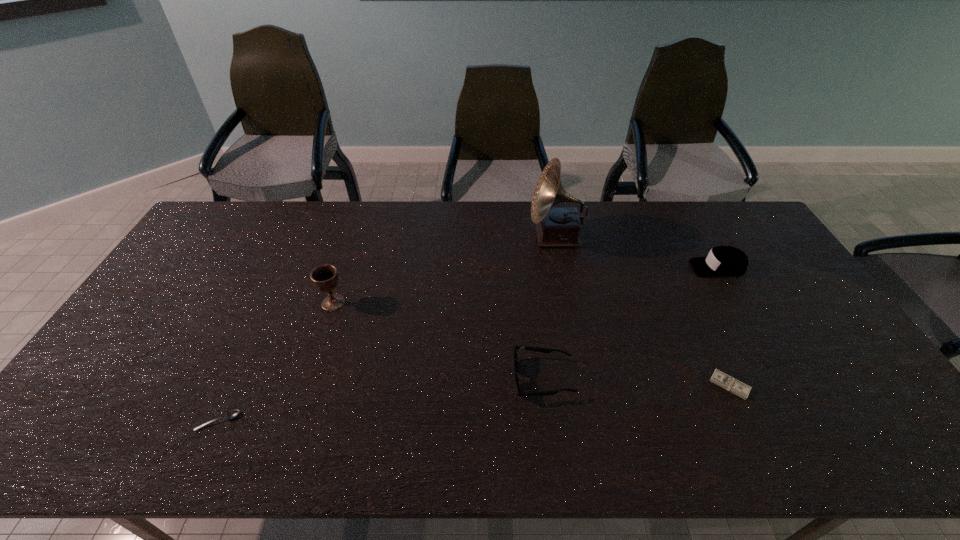
You are a GUI agent. You are given a task and a screenshot of the screen. Output one action in this format:
    pyautogui.click(x=<x>, y=<y>)
    Task: Click on the vacant space located 0.220m on the left of the nearest object
    The image size is (960, 540).
    Given the screenshot: What is the action you would take?
    pyautogui.click(x=106, y=421)

Identify the location of object located in the far edge section of the desktop. This screenshot has width=960, height=540. (558, 227).

The image size is (960, 540). What are the coordinates of `object present at the near edge` in the screenshot? It's located at (233, 413).

This screenshot has height=540, width=960. What are the coordinates of `object located at the right edge` in the screenshot? It's located at (728, 261).

The height and width of the screenshot is (540, 960). I want to click on free space at the far edge of the desktop, so click(x=668, y=218).

Find the location of `free region at the left edge of the desktop`. free region at the left edge of the desktop is located at coordinates pyautogui.click(x=142, y=311).

Image resolution: width=960 pixels, height=540 pixels. What are the coordinates of `vacant space at the right edge` in the screenshot? It's located at [865, 406].

The image size is (960, 540). What are the coordinates of `vacant area at the far left corner` in the screenshot? It's located at (208, 238).

This screenshot has height=540, width=960. I want to click on vacant area at the far right corner, so click(719, 238).

Where is `vacant area that lies between the cap and the leftmost object`? This screenshot has width=960, height=540. vacant area that lies between the cap and the leftmost object is located at coordinates (468, 345).